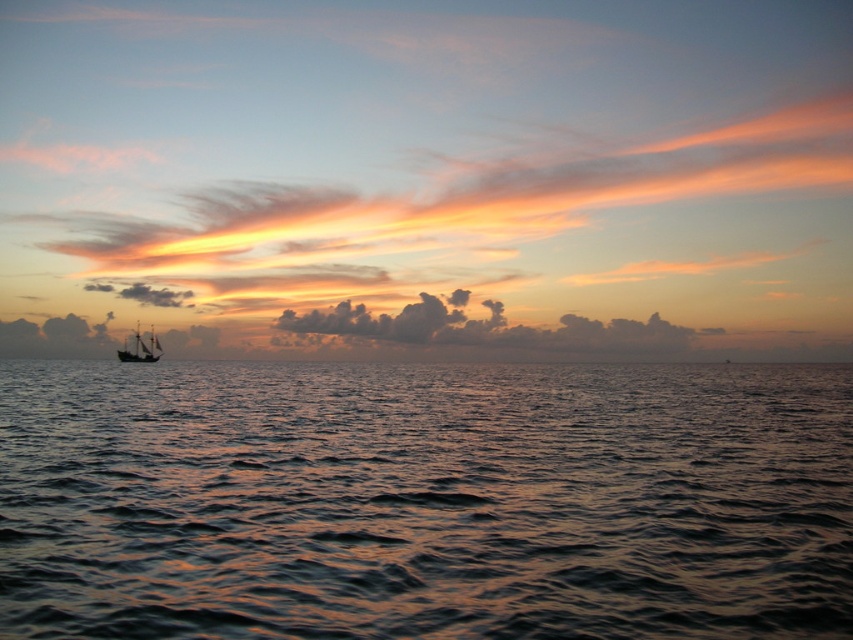
You are standing on the shore and see the glistening water at center and the wooden ship at left. Which object appears broader in width from your viewpoint?

The glistening water at center might be wider than wooden ship at left according to the description.

You are standing on the shore looking at the seascape. You see the glistening water at center and the wooden ship at left. Which object is closer to your right side?

The glistening water at center is closer to your right side since it is positioned to the right of the wooden ship at left.